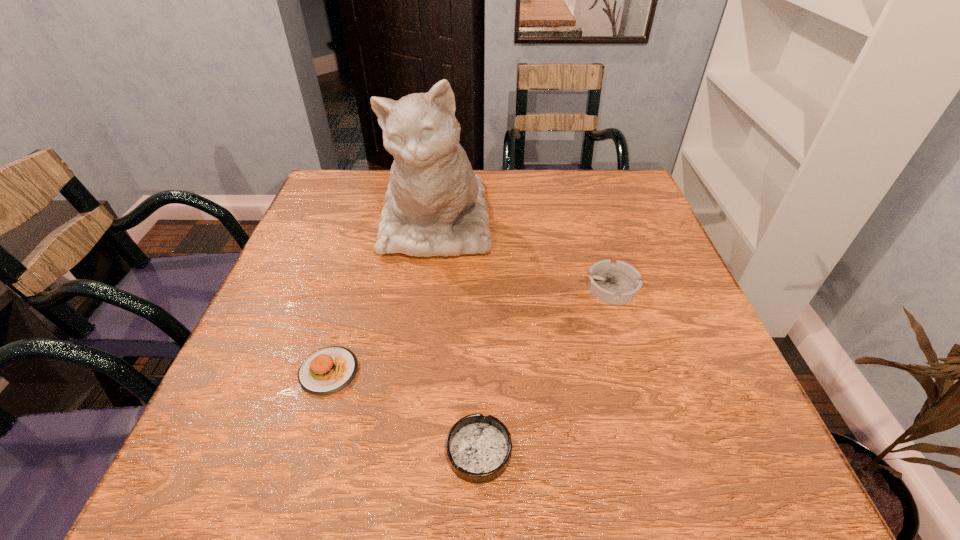
Identify the location of free space between the shorter ashtray and the food. The width and height of the screenshot is (960, 540). (404, 411).

Locate which object is the second closest to the cat. Please provide its 2D coordinates. Your answer should be formatted as a tuple, i.e. [(x, y)], where the tuple contains the x and y coordinates of a point satisfying the conditions above.

[(327, 370)]

Select which object appears as the second closest to the rightmost object. Please provide its 2D coordinates. Your answer should be formatted as a tuple, i.e. [(x, y)], where the tuple contains the x and y coordinates of a point satisfying the conditions above.

[(479, 448)]

Identify the location of vacant point that satisfies the following two spatial constraints: 1. on the front-facing side of the left ashtray; 2. on the right side of the tallest object. (408, 451).

Locate an element on the screen. Image resolution: width=960 pixels, height=540 pixels. vacant position in the image that satisfies the following two spatial constraints: 1. on the front-facing side of the taller ashtray; 2. on the left side of the tallest object is located at coordinates (428, 287).

This screenshot has height=540, width=960. In order to click on vacant region that satisfies the following two spatial constraints: 1. on the back side of the rightmost object; 2. on the left side of the left ashtray in this screenshot , I will do `click(479, 287)`.